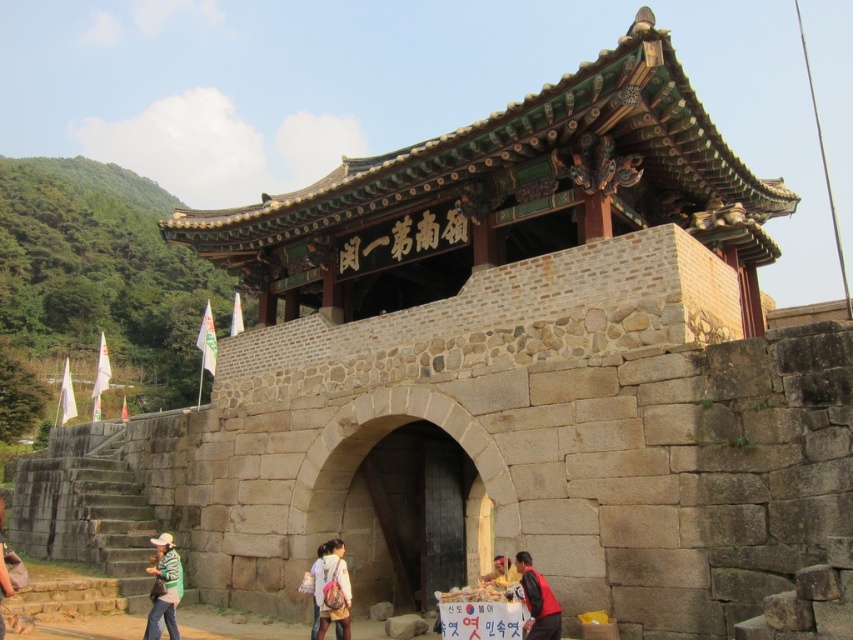
You are a visitor at the historical site and see both the dark red leather jacket at lower center and the light pink fabric backpack at lower center. Which object is positioned more to the right side?

The dark red leather jacket at lower center is positioned to the right of the light pink fabric backpack at lower center, so it is more to the right side.

You are a photographer planning to take a photo of the traditional Korean gate. You notice a dark red leather jacket at lower center and a light pink fabric backpack at lower center in the foreground. To ensure both items are clearly visible in the photo, which one should you focus on first to avoid blurring due to their positions?

The dark red leather jacket at lower center is located above the light pink fabric backpack at lower center. Since the jacket is higher up, focusing on it first might help in keeping both items sharp, but you need to ensure the camera is focused on the main subject, which is the gate. Alternatively, using a smaller aperture for a deeper depth of field would be better to capture both foreground items and the gate clearly.

You are a tourist standing in front of the traditional Korean gate. You see a green striped shirt at lower left and a dark red leather jacket at lower center. Which object is closer to you?

The green striped shirt at lower left is closer to you because the dark red leather jacket at lower center is behind it.